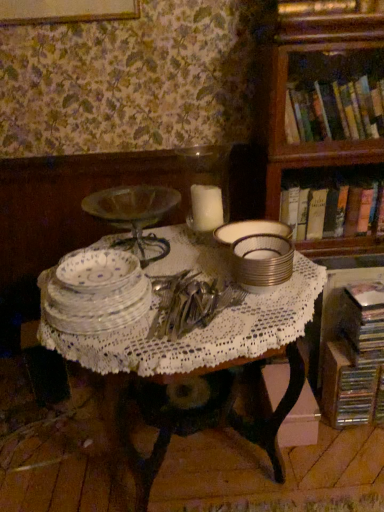
The width and height of the screenshot is (384, 512). I want to click on vacant area in front of silver metallic stack at center, the second tableware viewed from the left, so click(x=266, y=319).